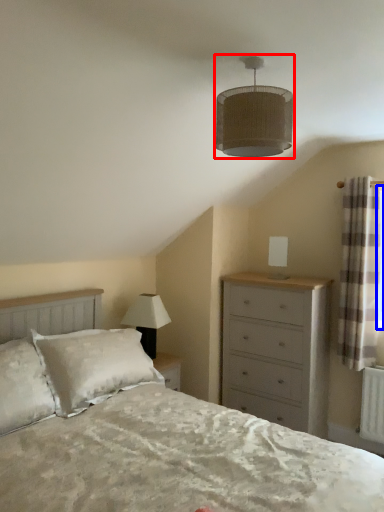
Question: Which point is further to the camera, lamp (highlighted by a red box) or window screen (highlighted by a blue box)?

Choices:
 (A) lamp
 (B) window screen

Answer: (B)